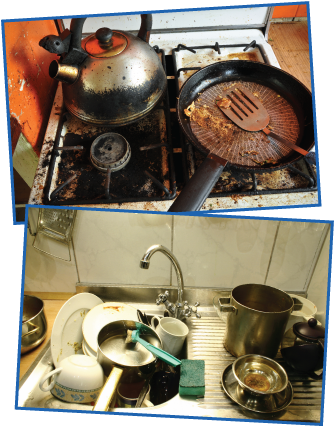
The image size is (335, 427). Identify the location of food pieces in dirty frying pan. (205, 123), (225, 101).